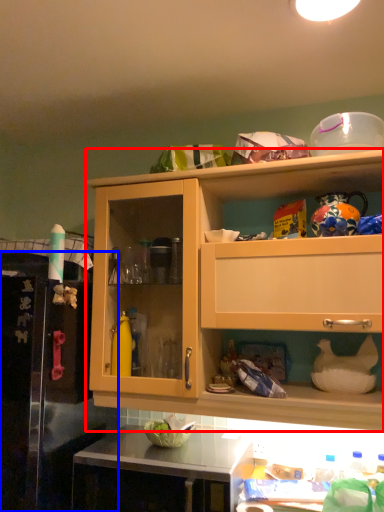
Question: Which point is closer to the camera, cabinetry (highlighted by a red box) or leftover (highlighted by a blue box)?

Choices:
 (A) cabinetry
 (B) leftover

Answer: (B)